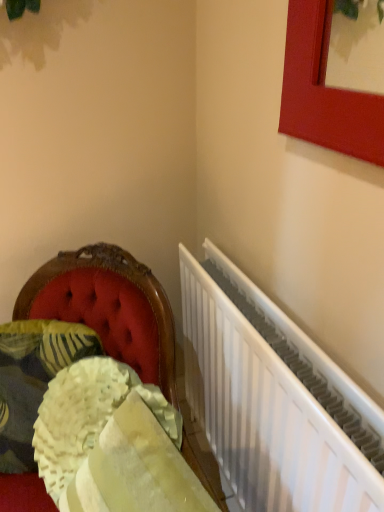
Question: From a real-world perspective, is velvet cushion at left physically located above or below white metallic radiator at right?

Choices:
 (A) above
 (B) below

Answer: (A)

Question: In terms of height, does velvet cushion at left look taller or shorter compared to white metallic radiator at right?

Choices:
 (A) tall
 (B) short

Answer: (B)

Question: Estimate the real-world distances between objects in this image. Which object is farther from the fluffy cream cushion at lower left?

Choices:
 (A) velvet cushion at left
 (B) fluffy white pillow at lower left
 (C) white metallic radiator at right

Answer: (C)

Question: Estimate the real-world distances between objects in this image. Which object is farther from the velvet cushion at left?

Choices:
 (A) fluffy cream cushion at lower left
 (B) fluffy white pillow at lower left
 (C) white metallic radiator at right

Answer: (C)